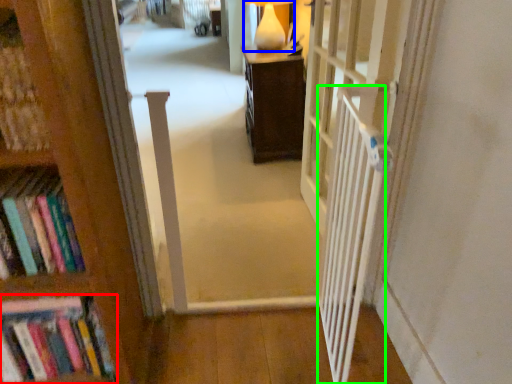
Question: Based on their relative distances, which object is farther from book (highlighted by a red box)? Choose from table lamp (highlighted by a blue box) and balustrade (highlighted by a green box).

Choices:
 (A) table lamp
 (B) balustrade

Answer: (A)